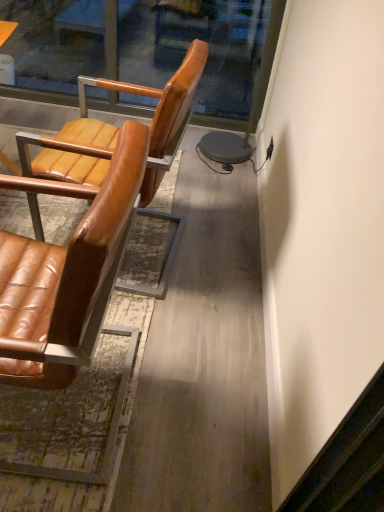
Locate an element on the screen. vacant space to the right of brown leather chair at left, which appears as the first chair when viewed from the back is located at coordinates (215, 263).